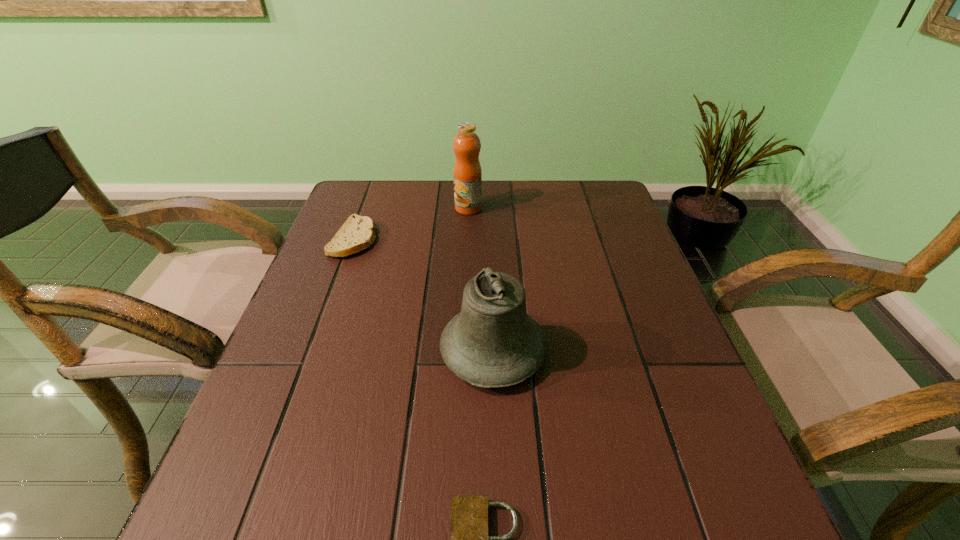
I want to click on pita bread located in the far edge section of the desktop, so click(x=357, y=234).

Find the location of a particular element. object that is at the left edge is located at coordinates (357, 234).

You are a GUI agent. You are given a task and a screenshot of the screen. Output one action in this format:
    pyautogui.click(x=<x>, y=<y>)
    Task: Click on the object that is at the far left corner
    This screenshot has width=960, height=540.
    Given the screenshot: What is the action you would take?
    pyautogui.click(x=357, y=234)

Locate an element on the screen. This screenshot has width=960, height=540. vacant space at the far edge is located at coordinates pyautogui.click(x=410, y=205).

In the image, there is a desktop. Identify the location of vacant space at the near edge. The image size is (960, 540). (613, 492).

In the image, there is a desktop. What are the coordinates of `free space at the left edge` in the screenshot? It's located at (335, 395).

Find the location of `vacant space at the right edge of the desktop`. vacant space at the right edge of the desktop is located at coordinates (615, 251).

What are the coordinates of `vacant space at the near left corner` in the screenshot? It's located at (297, 494).

Identify the location of vacant point at the far right corner. (615, 198).

At what (x,y) coordinates should I click in order to perform the action: click on free point between the farthest object and the second farthest object. Please return your answer as a coordinate pair (x, y). The width and height of the screenshot is (960, 540). Looking at the image, I should click on (411, 224).